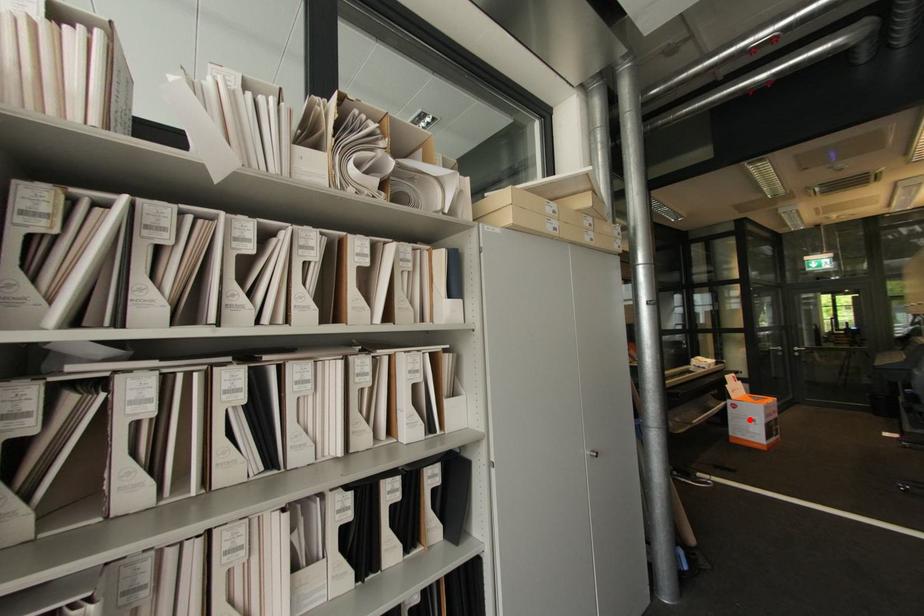
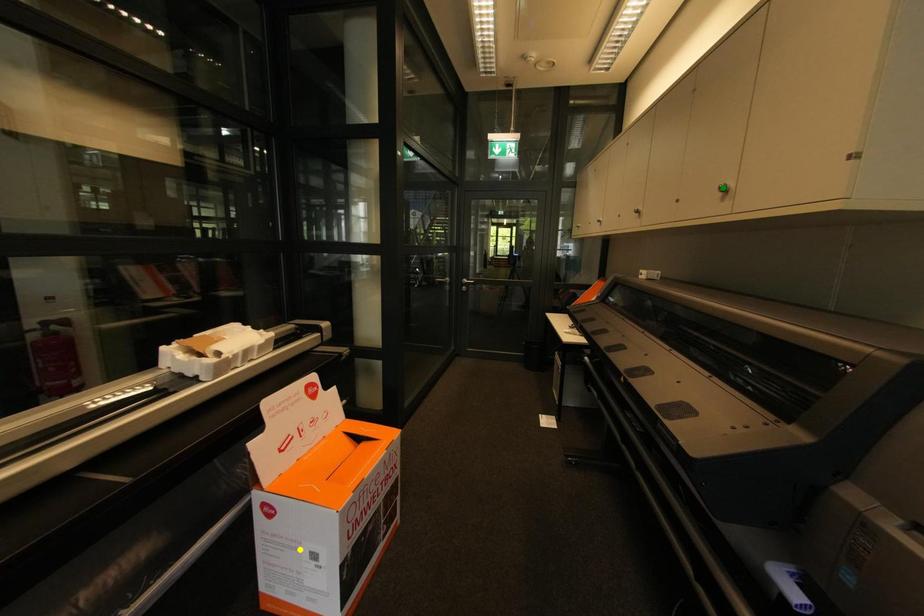
Question: I am providing you with two images of the same scene from different viewpoints. A red point is marked on the first image. You are given multiple points on the second image. Can you choose the point in image 2 that corresponds to the point in image 1?

Choices:
 (A) blue point
 (B) yellow point
 (C) green point

Answer: (B)